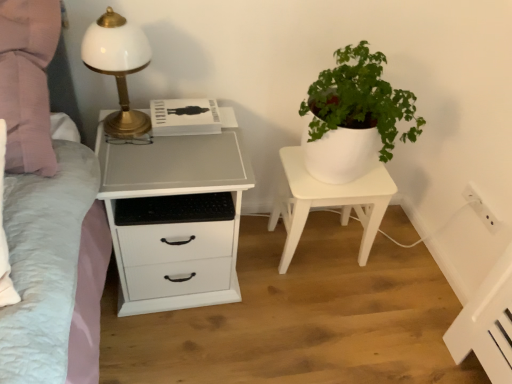
The width and height of the screenshot is (512, 384). I want to click on vacant space underneath white matte plant pot at center (from a real-world perspective), so click(325, 244).